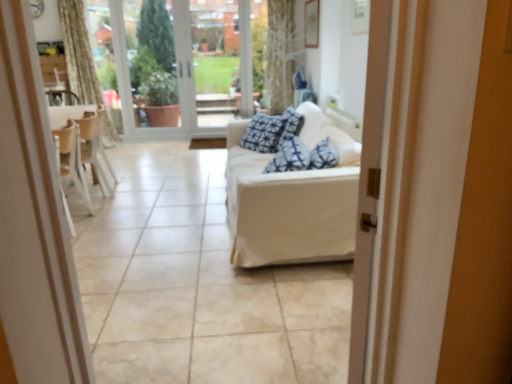
Question: Considering the relative sizes of wooden chair at left and white fabric couch at center in the image provided, is wooden chair at left thinner than white fabric couch at center?

Choices:
 (A) yes
 (B) no

Answer: (A)

Question: From a real-world perspective, is wooden chair at left physically above white fabric couch at center?

Choices:
 (A) no
 (B) yes

Answer: (A)

Question: Is wooden chair at left oriented away from white fabric couch at center?

Choices:
 (A) yes
 (B) no

Answer: (A)

Question: From a real-world perspective, is wooden chair at left physically below white fabric couch at center?

Choices:
 (A) no
 (B) yes

Answer: (B)

Question: Is wooden chair at left aimed at white fabric couch at center?

Choices:
 (A) no
 (B) yes

Answer: (A)

Question: Considering the relative sizes of wooden chair at left and white fabric couch at center in the image provided, is wooden chair at left taller than white fabric couch at center?

Choices:
 (A) no
 (B) yes

Answer: (A)

Question: Can you confirm if white fabric couch at center is taller than white glass door at upper center?

Choices:
 (A) no
 (B) yes

Answer: (A)

Question: Does white fabric couch at center have a greater width compared to white glass door at upper center?

Choices:
 (A) no
 (B) yes

Answer: (B)

Question: Is white fabric couch at center not near white glass door at upper center?

Choices:
 (A) no
 (B) yes

Answer: (B)

Question: Does white fabric couch at center lie behind white glass door at upper center?

Choices:
 (A) no
 (B) yes

Answer: (A)

Question: Is white fabric couch at center next to white glass door at upper center?

Choices:
 (A) no
 (B) yes

Answer: (A)

Question: From the image's perspective, is white fabric couch at center below white glass door at upper center?

Choices:
 (A) yes
 (B) no

Answer: (A)

Question: Can you confirm if transparent glass door at center is bigger than white fabric couch at center?

Choices:
 (A) yes
 (B) no

Answer: (B)